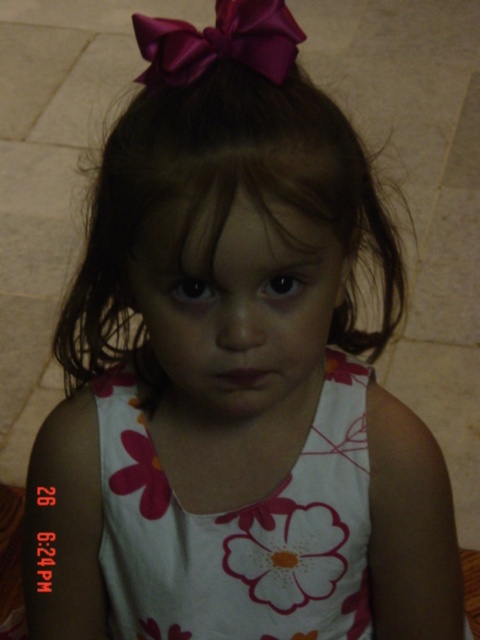
Based on the scene description, where is the smooth skin face at center in relation to the satin purple bow at upper center?

The smooth skin face at center is to the right of the satin purple bow at upper center.

Based on the photo, the girl is wearing a white floral dress at center and has a satin purple bow at upper center. Which item is positioned higher on her body?

The satin purple bow at upper center is positioned higher on her body than the white floral dress at center.

You are a photographer adjusting the camera focus. The subject is the young girl in the image. The white floral dress at center is located at point (x=239, y=529). Where should you focus to ensure the dress is sharp?

You should focus at point (x=239, y=529) to ensure the white floral dress at center is sharp.